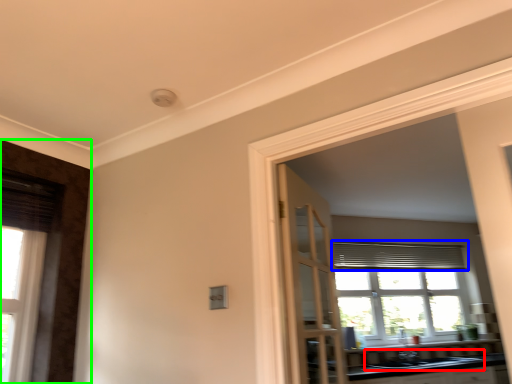
Question: Which object is positioned farthest from sink (highlighted by a red box)? Select from curtain (highlighted by a blue box) and door (highlighted by a green box).

Choices:
 (A) curtain
 (B) door

Answer: (B)